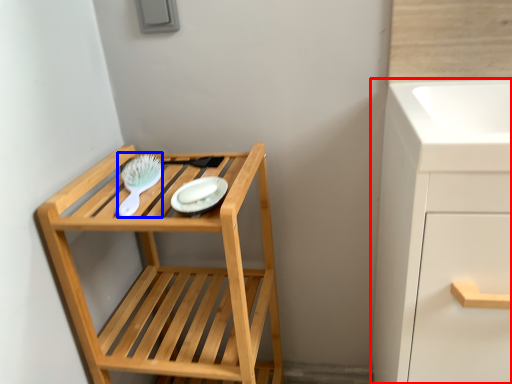
Question: Which point is closer to the camera, bathroom cabinet (highlighted by a red box) or brush (highlighted by a blue box)?

Choices:
 (A) bathroom cabinet
 (B) brush

Answer: (A)